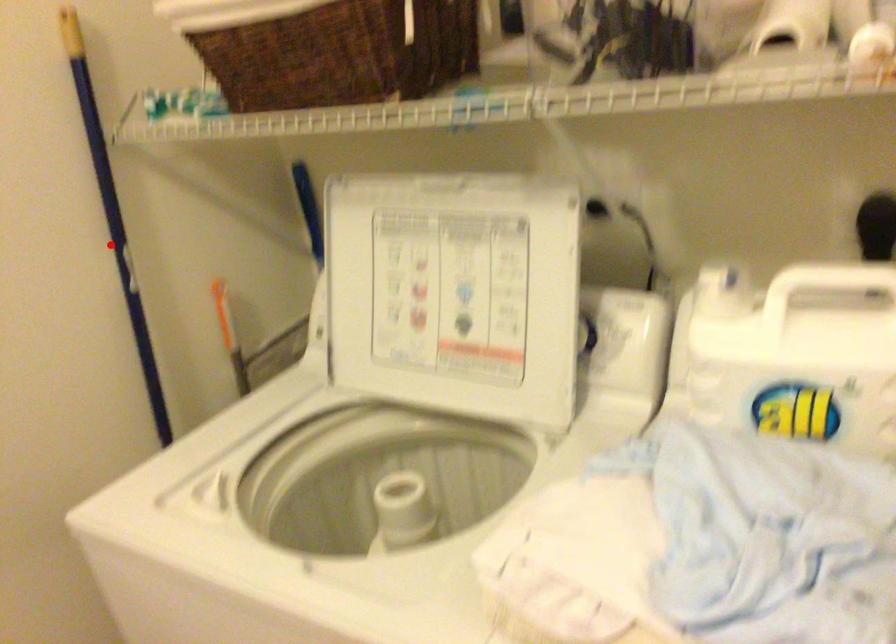
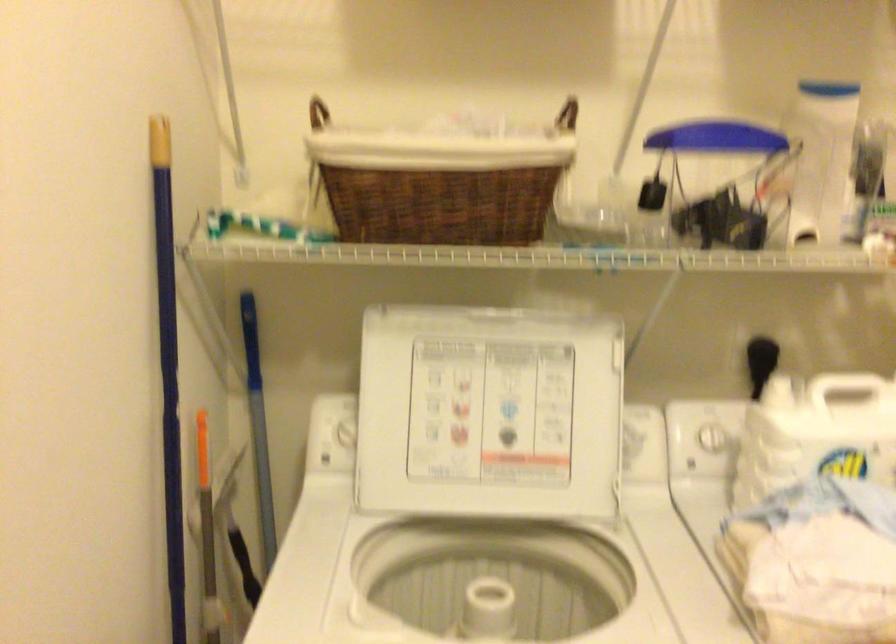
The point at the highlighted location is marked in the first image. Where is the corresponding point in the second image?

(168, 366)